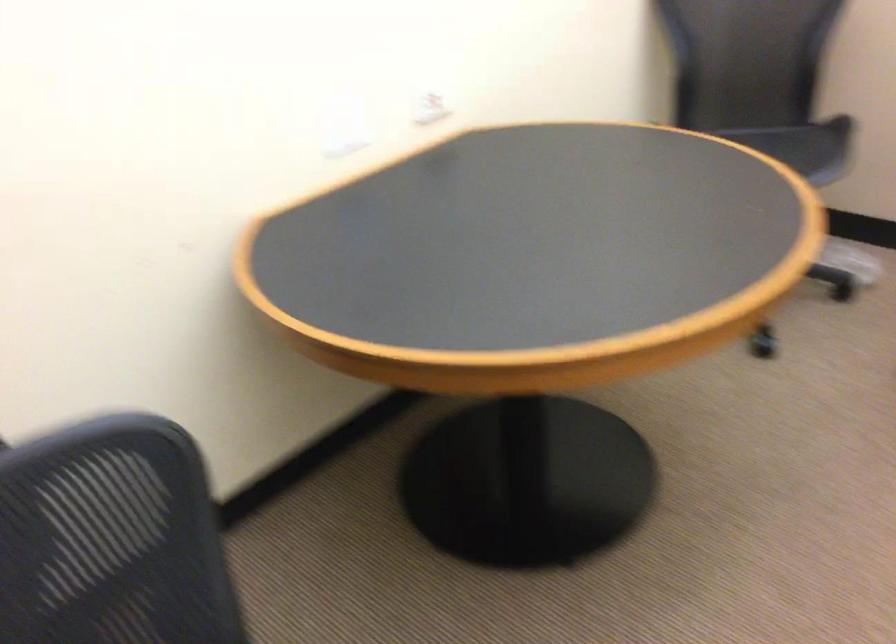
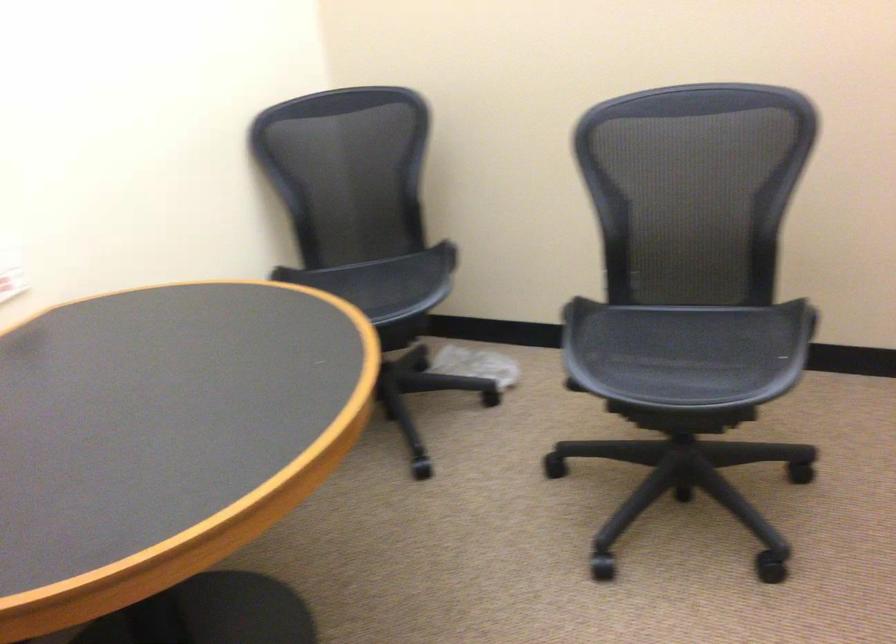
Question: How did the camera likely rotate?

Choices:
 (A) Left
 (B) Right
 (C) Up
 (D) Down

Answer: (B)